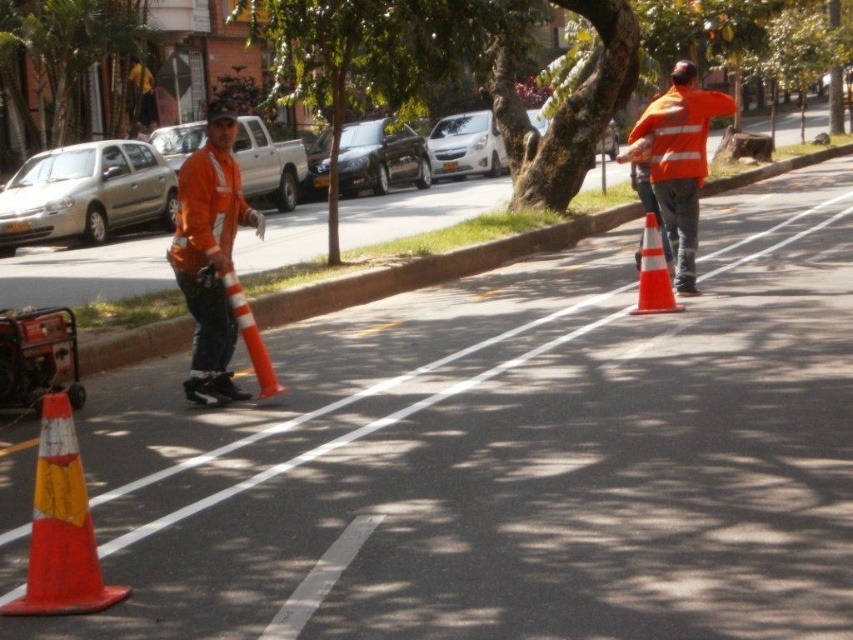
You are a pedestrian trying to cross the road safely. You see a matte orange safety vest at center and an orange reflective cone at right. Which object is taller and could potentially block your view of oncoming traffic?

The matte orange safety vest at center is taller than the orange reflective cone at right, so it could potentially block your view of oncoming traffic.

Based on the photo, you are a pedestrian crossing the street and see the matte orange safety vest at center and the orange reflective cone at right. Which object is closer to you?

The matte orange safety vest at center is closer to you because it is positioned in front of the orange reflective cone at right.